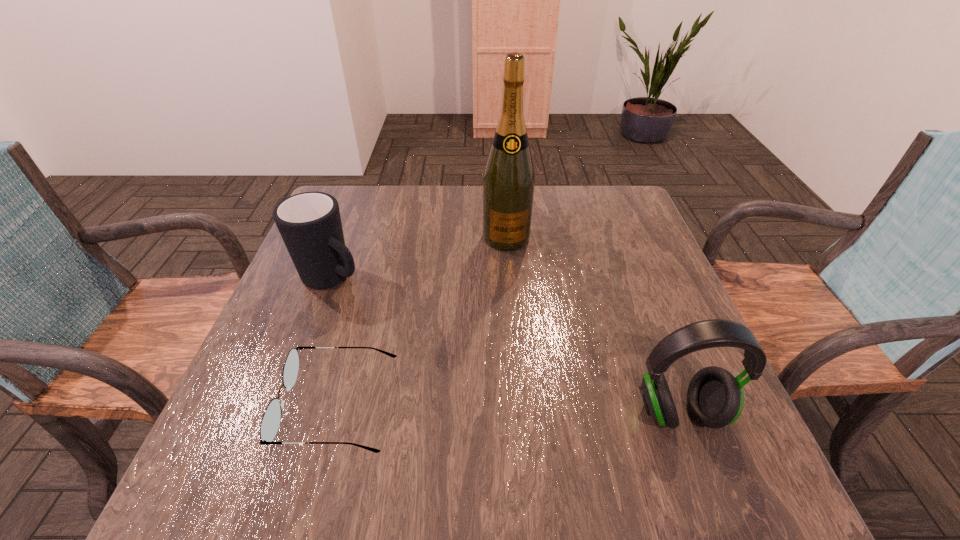
In the image, there is a desktop. Where is `vacant space at the far edge`? vacant space at the far edge is located at coordinates (425, 218).

Locate an element on the screen. free space at the near edge of the desktop is located at coordinates (348, 405).

Find the location of `vacant space at the left edge`. vacant space at the left edge is located at coordinates (317, 340).

Locate an element on the screen. vacant area at the right edge is located at coordinates (x=635, y=295).

In the image, there is a desktop. Identify the location of vacant space at the far left corner. The width and height of the screenshot is (960, 540). (366, 199).

Where is `vacant space at the far right corner`? vacant space at the far right corner is located at coordinates (601, 196).

This screenshot has width=960, height=540. What are the coordinates of `free space between the rightmost object and the third object from left to right` in the screenshot? It's located at (592, 325).

Identify the location of vacant region between the shortest object and the third object from left to right. (422, 321).

You are a GUI agent. You are given a task and a screenshot of the screen. Output one action in this format:
    pyautogui.click(x=<x>, y=<y>)
    Task: Click on the free space between the wine bottle and the rightmost object
    
    Given the screenshot: What is the action you would take?
    pyautogui.click(x=592, y=325)

The height and width of the screenshot is (540, 960). I want to click on free point between the tallest object and the mug, so click(420, 258).